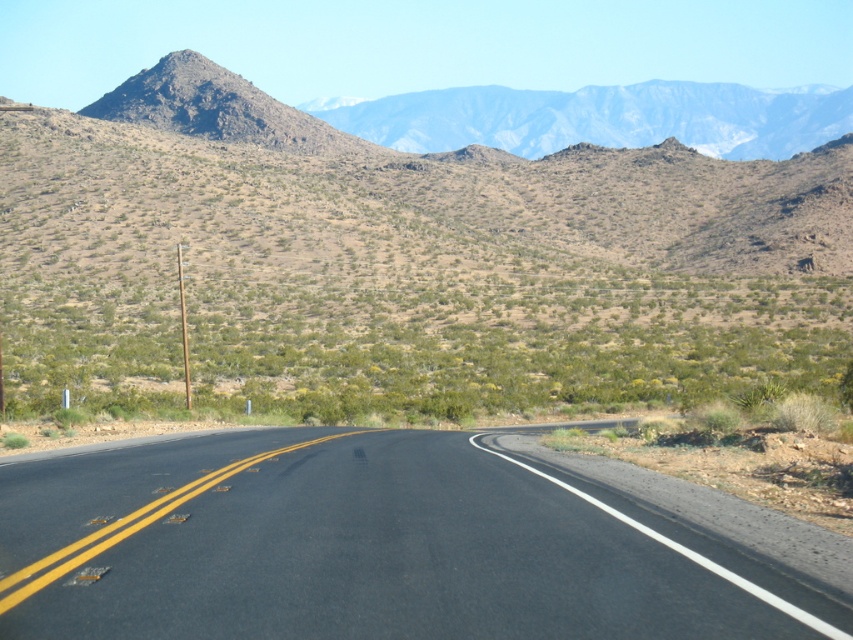
Does black asphalt road at center have a larger size compared to rugged rock mountain range at upper center?

No.

Does black asphalt road at center have a greater width compared to rugged rock mountain range at upper center?

Incorrect, black asphalt road at center's width does not surpass rugged rock mountain range at upper center's.

This screenshot has width=853, height=640. Describe the element at coordinates (363, 547) in the screenshot. I see `black asphalt road at center` at that location.

What are the coordinates of `black asphalt road at center` in the screenshot? It's located at (363, 547).